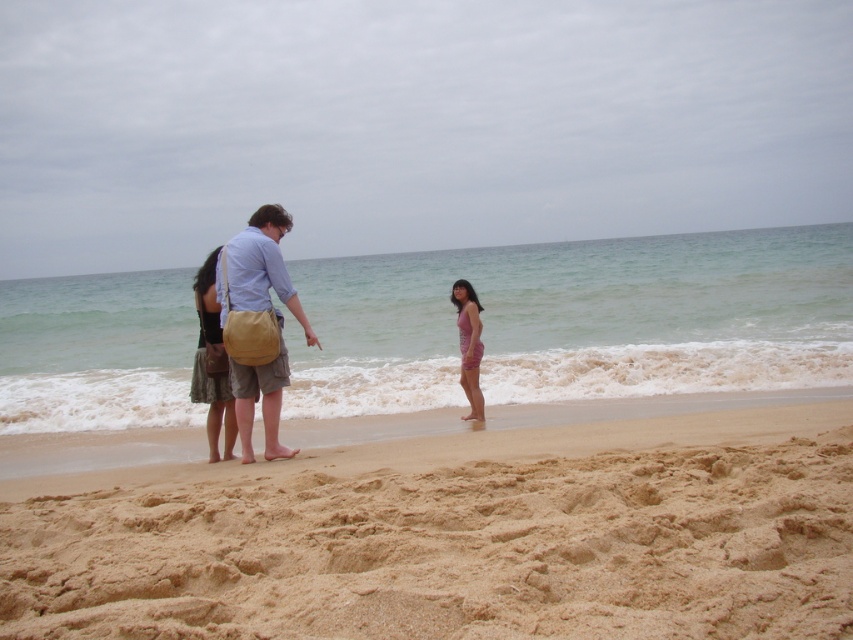
You are a photographer at the beach scene. You have a camera with a 10cm wide lens. You need to capture both the light brown canvas bag at center and the black textured dress at center in the same frame. Which object should you focus on to ensure both fit in the frame?

The light brown canvas bag at center is wider than the black textured dress at center. Since the lens is 10cm wide, you should focus on the wider object, the light brown canvas bag at center, to ensure both fit within the frame.

You are standing on the beach and want to place a new item at the coordinates given in the description. If you have a seashell that needs to be placed exactly where the black textured dress at center is located, will it overlap with any other objects in the scene?

The black textured dress at center is located at point [212,364]. Since no other objects are mentioned in the scene description at that specific coordinate, placing the seashell there would not overlap with any other objects.

You are standing on the beach and want to take a photo of the two points marked in the scene. Which point, point 1 at coordinates point [279,349] or point 2 at coordinates point [460,296], is closer to you so it will appear larger in your camera view?

Point 1 at coordinates point [279,349] is closer to the camera than point 2 at coordinates point [460,296], so it will appear larger in the camera view.